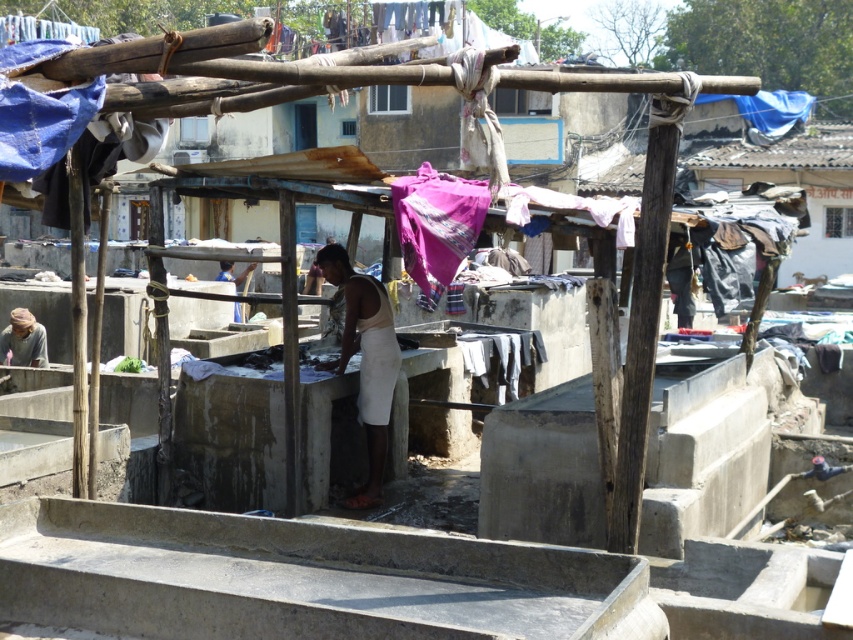
Which is more to the right, white cotton cloth at center or white cotton dress at lower center?

white cotton cloth at center

Is white cotton cloth at center smaller than white cotton dress at lower center?

Actually, white cotton cloth at center might be larger than white cotton dress at lower center.

Where is `white cotton cloth at center`? The width and height of the screenshot is (853, 640). white cotton cloth at center is located at coordinates (364, 360).

This screenshot has height=640, width=853. I want to click on white cotton cloth at center, so click(x=364, y=360).